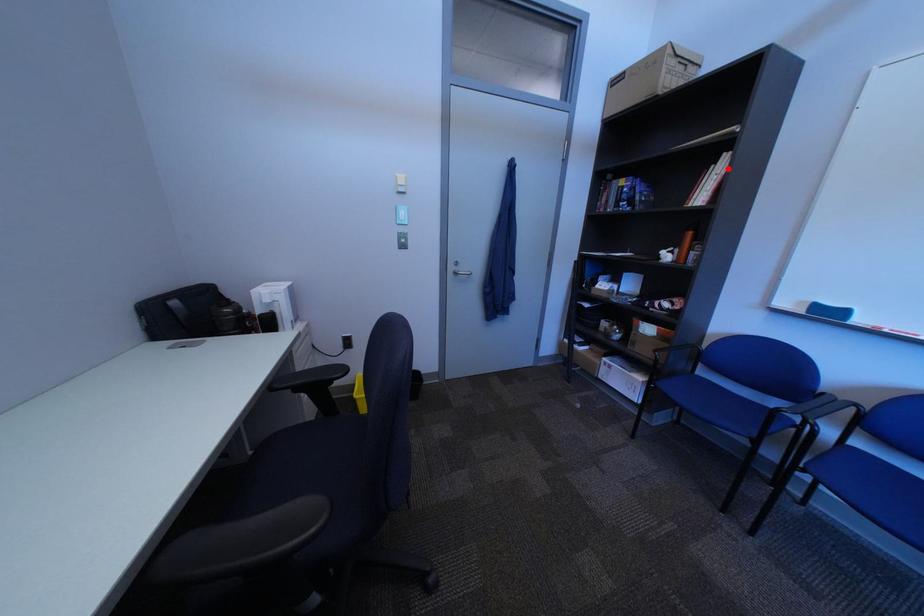
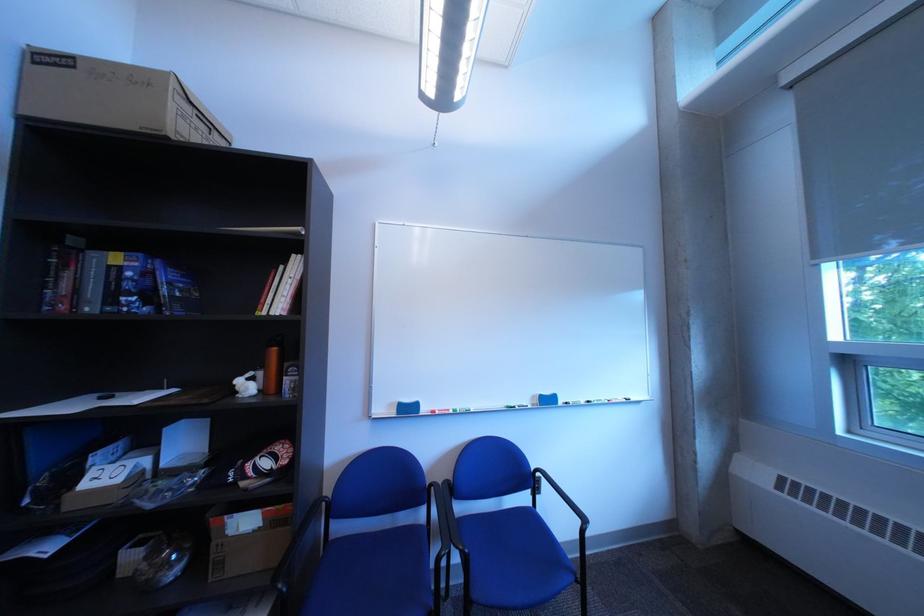
In the second image, find the point that corresponds to the highlighted location in the first image.

(297, 270)